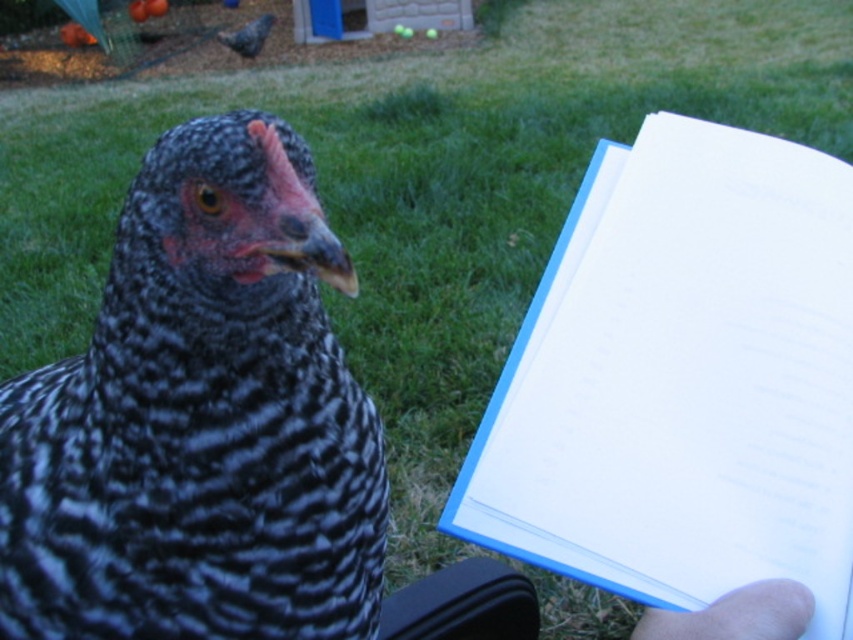
You are a photographer trying to capture a photo of the speckled feathered chicken at center and the smooth skin hand at lower right in the same frame. Based on their positions, which object is closer to the left edge of the image?

The speckled feathered chicken at center is to the left of smooth skin hand at lower right, so the speckled feathered chicken at center is closer to the left edge of the image.

You are holding a book with blue edges and want to place it exactly where the chicken is standing. The chicken is at point [178,426]. If the book is 12 inches wide, will it fit without overlapping the chicken?

The point [178,426] is 20.76 inches from the camera. Since the book is 12 inches wide, it can be placed at that point without overlapping the chicken as the distance allows sufficient space.